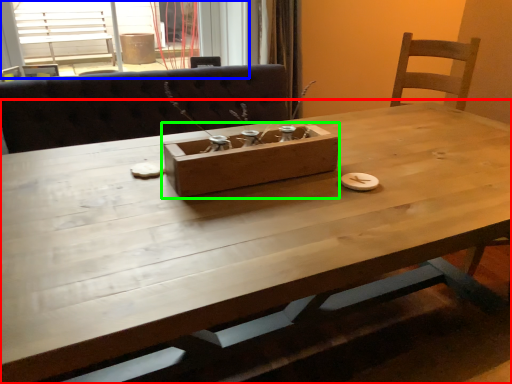
Question: Which is farther away from table (highlighted by a red box)? window (highlighted by a blue box) or cardboard box (highlighted by a green box)?

Choices:
 (A) window
 (B) cardboard box

Answer: (A)